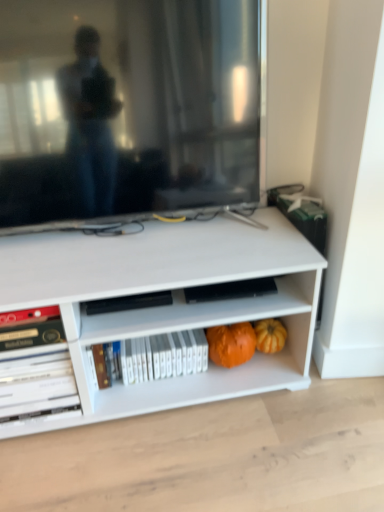
Question: From a real-world perspective, does white glossy book at lower left, the first book from the left, sit lower than orange matte pumpkin at lower center, the second pumpkin viewed from the right?

Choices:
 (A) no
 (B) yes

Answer: (A)

Question: Are white glossy book at lower left, marked as the second book in a right-to-left arrangement, and orange matte pumpkin at lower center, which is the first pumpkin in left-to-right order, beside each other?

Choices:
 (A) yes
 (B) no

Answer: (B)

Question: Could orange matte pumpkin at lower center, which is the first pumpkin in left-to-right order, be considered to be inside white glossy book at lower left, the first book from the left?

Choices:
 (A) no
 (B) yes

Answer: (A)

Question: Can you confirm if white glossy book at lower left, marked as the second book in a right-to-left arrangement, is shorter than orange matte pumpkin at lower center, the second pumpkin viewed from the right?

Choices:
 (A) yes
 (B) no

Answer: (B)

Question: Does white glossy book at lower left, the first book from the left, have a lesser width compared to orange matte pumpkin at lower center, the second pumpkin viewed from the right?

Choices:
 (A) yes
 (B) no

Answer: (B)

Question: From a real-world perspective, is white glossy book at lower left, the first book from the left, located higher than orange matte pumpkin at lower center, the second pumpkin viewed from the right?

Choices:
 (A) no
 (B) yes

Answer: (B)

Question: Is orange matte pumpkin at lower center, which is the first pumpkin in left-to-right order, far away from matte black television at upper center?

Choices:
 (A) no
 (B) yes

Answer: (A)

Question: Is the depth of orange matte pumpkin at lower center, which is the first pumpkin in left-to-right order, less than that of matte black television at upper center?

Choices:
 (A) yes
 (B) no

Answer: (B)

Question: Does orange matte pumpkin at lower center, the second pumpkin viewed from the right, have a lesser height compared to matte black television at upper center?

Choices:
 (A) yes
 (B) no

Answer: (A)

Question: Can you confirm if orange matte pumpkin at lower center, the second pumpkin viewed from the right, is positioned to the left of matte black television at upper center?

Choices:
 (A) no
 (B) yes

Answer: (A)

Question: Is orange matte pumpkin at lower center, the second pumpkin viewed from the right, outside of matte black television at upper center?

Choices:
 (A) yes
 (B) no

Answer: (A)

Question: Is orange matte pumpkin at lower center, the second pumpkin viewed from the right, turned away from matte black television at upper center?

Choices:
 (A) no
 (B) yes

Answer: (A)

Question: Is orange matte pumpkin at lower center, the second pumpkin viewed from the right, further to camera compared to orange matte pumpkin at lower right, placed as the 1th pumpkin when sorted from right to left?

Choices:
 (A) yes
 (B) no

Answer: (B)